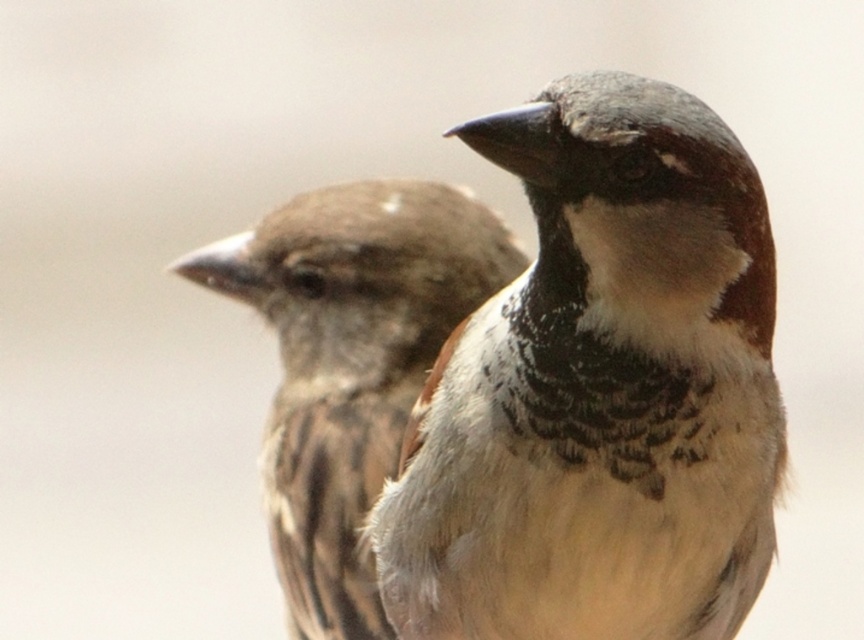
Question: Does brown speckled feathers at center appear over brown feathered sparrow at left?

Choices:
 (A) no
 (B) yes

Answer: (B)

Question: From the image, what is the correct spatial relationship of brown speckled feathers at center in relation to brown feathered sparrow at left?

Choices:
 (A) right
 (B) left

Answer: (A)

Question: Which point appears closest to the camera in this image?

Choices:
 (A) (302, 616)
 (B) (764, 324)

Answer: (B)

Question: Is brown speckled feathers at center wider than brown feathered sparrow at left?

Choices:
 (A) no
 (B) yes

Answer: (A)

Question: Which point appears closest to the camera in this image?

Choices:
 (A) (284, 237)
 (B) (678, 336)

Answer: (B)